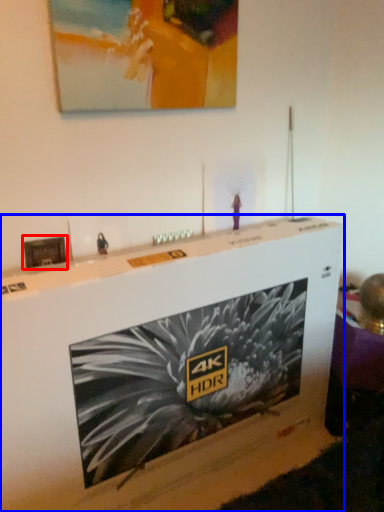
Question: Which object is closer to the camera taking this photo, picture frame (highlighted by a red box) or furniture (highlighted by a blue box)?

Choices:
 (A) picture frame
 (B) furniture

Answer: (B)